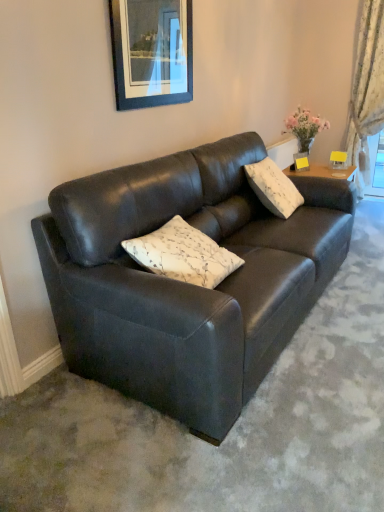
Question: Considering the relative sizes of white floral fabric curtain at right and white floral-patterned cushion at center, positioned as the second pillow in back-to-front order, in the image provided, is white floral fabric curtain at right taller than white floral-patterned cushion at center, positioned as the second pillow in back-to-front order,?

Choices:
 (A) yes
 (B) no

Answer: (A)

Question: Does white floral fabric curtain at right have a lesser width compared to white floral-patterned cushion at center, positioned as the 1th pillow in bottom-to-top order?

Choices:
 (A) yes
 (B) no

Answer: (A)

Question: Is white floral fabric curtain at right outside of white floral-patterned cushion at center, the second pillow when ordered from right to left?

Choices:
 (A) no
 (B) yes

Answer: (B)

Question: Does white floral fabric curtain at right contain white floral-patterned cushion at center, the first pillow in the front-to-back sequence?

Choices:
 (A) yes
 (B) no

Answer: (B)

Question: Is white floral fabric curtain at right beside white floral-patterned cushion at center, the first pillow in the front-to-back sequence?

Choices:
 (A) no
 (B) yes

Answer: (A)

Question: Considering the positions of point [x=163, y=226] and point [x=150, y=35], is point [x=163, y=226] closer or farther from the camera than point [x=150, y=35]?

Choices:
 (A) farther
 (B) closer

Answer: (B)

Question: Is white floral-patterned cushion at center, the first pillow in the front-to-back sequence, situated inside matte black picture frame at upper center or outside?

Choices:
 (A) outside
 (B) inside

Answer: (A)

Question: Is white floral-patterned cushion at center, the second pillow when ordered from right to left, wider or thinner than matte black picture frame at upper center?

Choices:
 (A) wide
 (B) thin

Answer: (A)

Question: Is white floral-patterned cushion at center, placed as the second pillow when sorted from top to bottom, to the left or to the right of matte black picture frame at upper center in the image?

Choices:
 (A) left
 (B) right

Answer: (B)

Question: Relative to white floral fabric curtain at right, is matte black picture frame at upper center in front or behind?

Choices:
 (A) front
 (B) behind

Answer: (A)

Question: From their relative heights in the image, would you say matte black picture frame at upper center is taller or shorter than white floral fabric curtain at right?

Choices:
 (A) short
 (B) tall

Answer: (A)

Question: Based on their sizes in the image, would you say matte black picture frame at upper center is bigger or smaller than white floral fabric curtain at right?

Choices:
 (A) big
 (B) small

Answer: (B)

Question: Would you say matte black picture frame at upper center is to the left or to the right of white floral fabric curtain at right in the picture?

Choices:
 (A) right
 (B) left

Answer: (B)

Question: From a real-world perspective, is white floral-patterned cushion at center, positioned as the second pillow in back-to-front order, physically located above or below matte black couch at center?

Choices:
 (A) above
 (B) below

Answer: (A)

Question: Looking at the image, does white floral-patterned cushion at center, positioned as the 1th pillow in bottom-to-top order, seem bigger or smaller compared to matte black couch at center?

Choices:
 (A) small
 (B) big

Answer: (A)